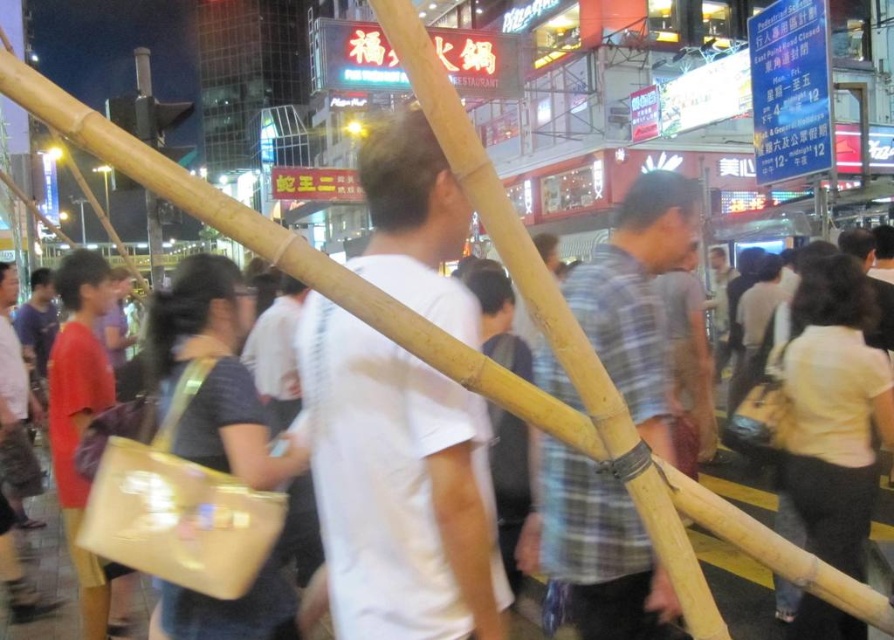
Question: Which point is farther to the camera?

Choices:
 (A) natural bamboo pole at center
 (B) white matte shirt at center

Answer: (B)

Question: Can you confirm if plaid fabric shirt at center is bigger than natural bamboo pole at center?

Choices:
 (A) no
 (B) yes

Answer: (A)

Question: Estimate the real-world distances between objects in this image. Which object is farther from the natural bamboo pole at center?

Choices:
 (A) plaid fabric shirt at center
 (B) white matte shirt at center

Answer: (B)

Question: Does white matte shirt at center appear over plaid fabric shirt at center?

Choices:
 (A) yes
 (B) no

Answer: (A)

Question: Is plaid fabric shirt at center closer to camera compared to natural bamboo pole at center?

Choices:
 (A) no
 (B) yes

Answer: (A)

Question: Considering the real-world distances, which object is farthest from the plaid fabric shirt at center?

Choices:
 (A) white matte shirt at center
 (B) natural bamboo pole at center

Answer: (A)